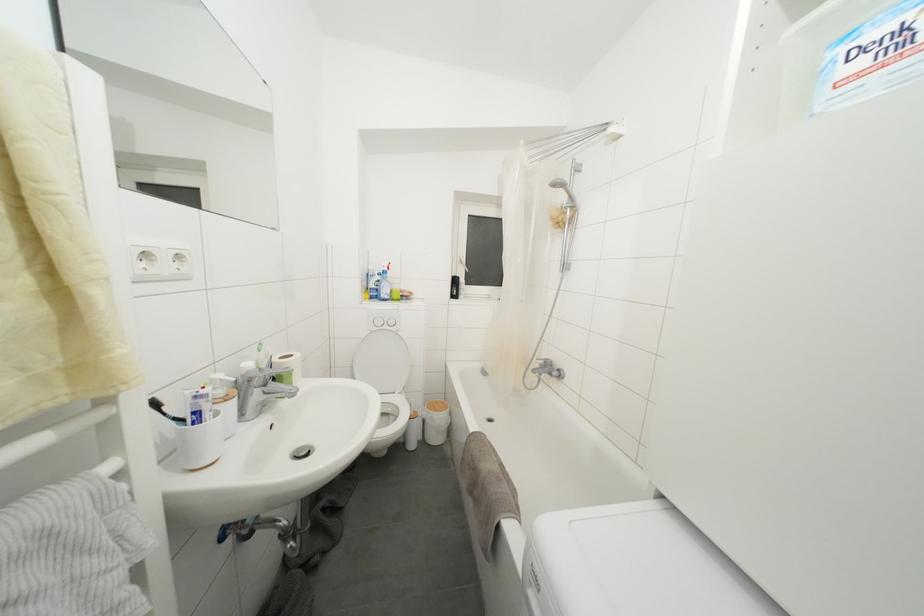
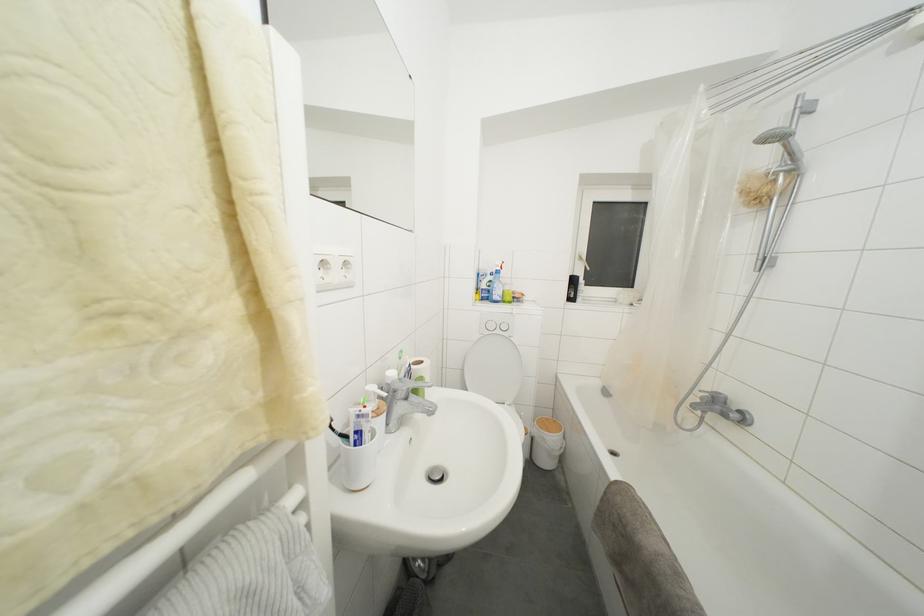
Find the pixel in the second image that matches (408,302) in the first image.

(520, 304)